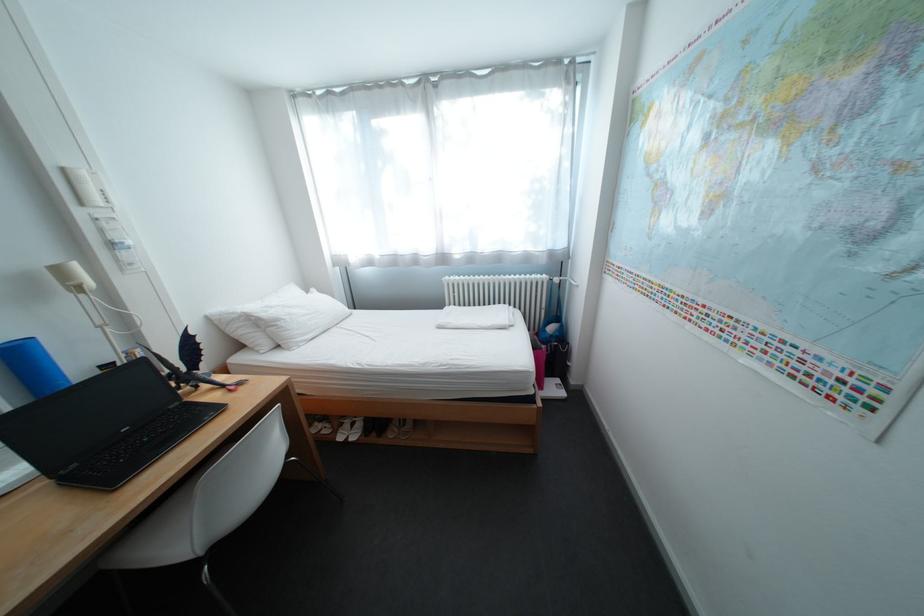
Where would you lift the white desk lamp? Please return your answer as a coordinate pair (x, y).

(84, 299)